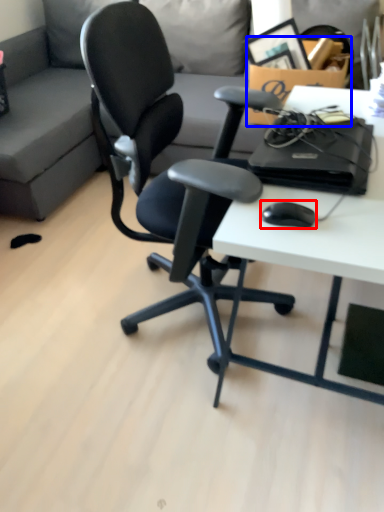
Question: Which of the following is the farthest to the observer, mouse (highlighted by a red box) or cardboard box (highlighted by a blue box)?

Choices:
 (A) mouse
 (B) cardboard box

Answer: (B)